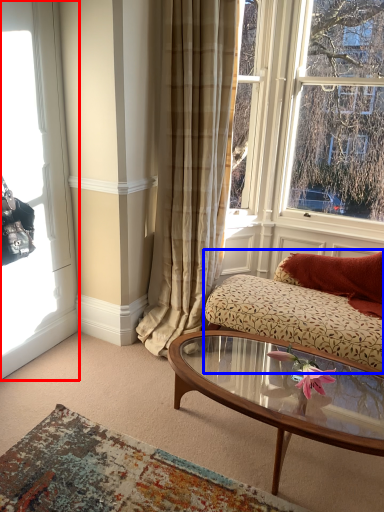
Question: Which object is closer to the camera taking this photo, window (highlighted by a red box) or studio couch (highlighted by a blue box)?

Choices:
 (A) window
 (B) studio couch

Answer: (A)